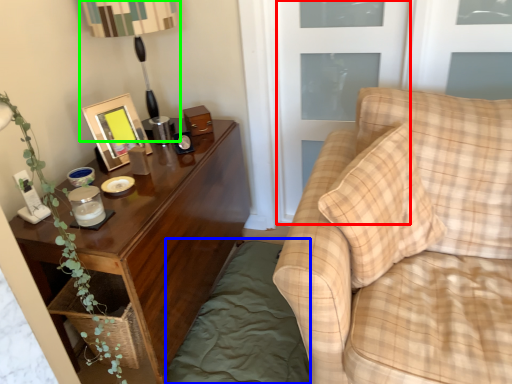
Question: Based on their relative distances, which object is nearer to screen door (highlighted by a red box)? Choose from bedding (highlighted by a blue box) and table lamp (highlighted by a green box).

Choices:
 (A) bedding
 (B) table lamp

Answer: (B)